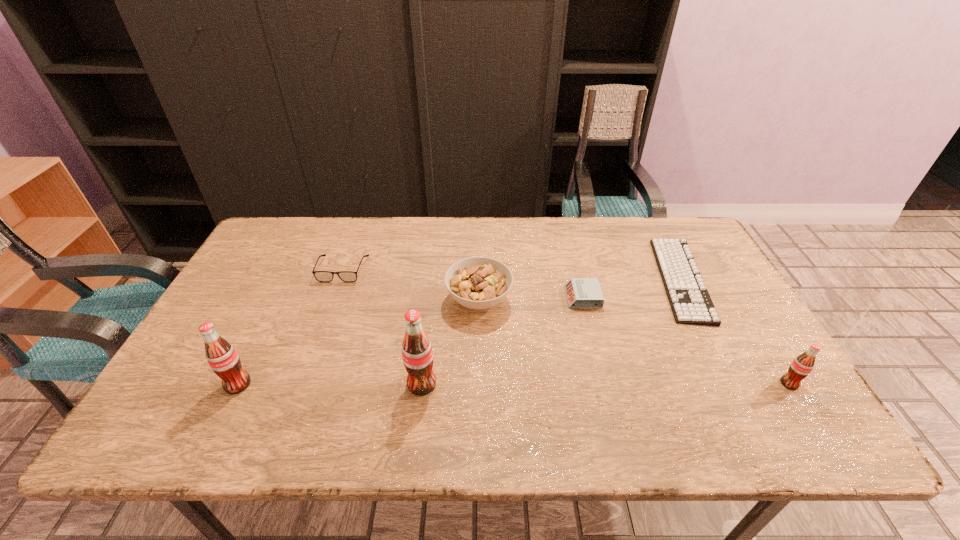
Locate an element on the screen. The height and width of the screenshot is (540, 960). computer keyboard is located at coordinates (690, 302).

Image resolution: width=960 pixels, height=540 pixels. In order to click on the fourth shortest object in this screenshot , I will do `click(478, 283)`.

The image size is (960, 540). I want to click on the fourth object from left to right, so click(478, 283).

The image size is (960, 540). Identify the location of vacant space located on the back of the second tallest object. coord(270,319).

The width and height of the screenshot is (960, 540). I want to click on vacant space positioned on the left of the second soda from right to left, so click(x=318, y=384).

Locate an element on the screen. The width and height of the screenshot is (960, 540). vacant space located on the back of the rightmost soda is located at coordinates (730, 288).

You are a GUI agent. You are given a task and a screenshot of the screen. Output one action in this format:
    pyautogui.click(x=<x>, y=<y>)
    Task: Click on the vacant space located 0.140m on the back of the alarm clock
    The image size is (960, 540).
    Given the screenshot: What is the action you would take?
    pyautogui.click(x=573, y=257)

The height and width of the screenshot is (540, 960). I want to click on vacant space situated 0.350m on the front-facing side of the spectacles, so click(x=301, y=382).

Find the location of a particular element. This screenshot has width=960, height=540. free space located 0.110m on the back of the shortest object is located at coordinates (652, 222).

Where is `free region located on the right of the fourth object from right to left`? The image size is (960, 540). free region located on the right of the fourth object from right to left is located at coordinates (612, 300).